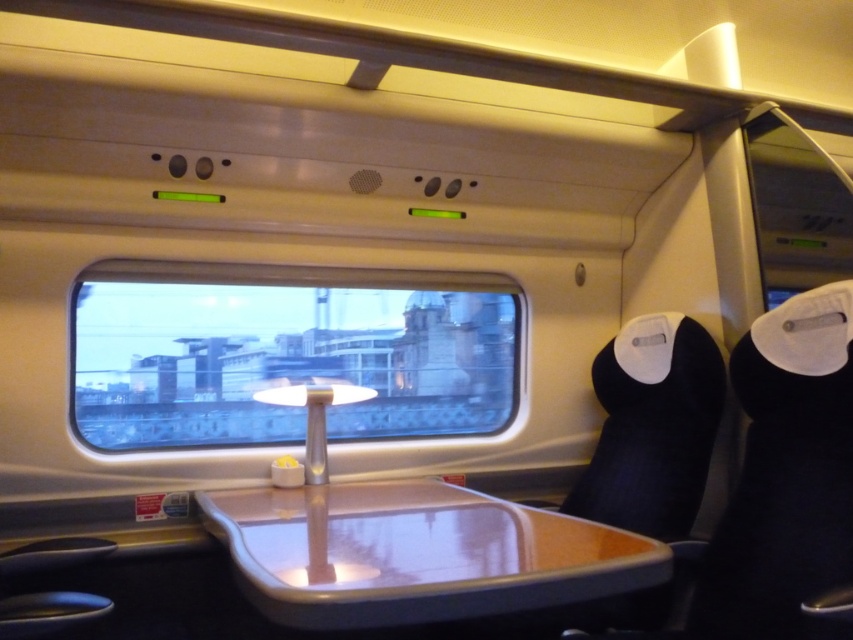
You are a passenger sitting in the train compartment and want to place your phone on the surface closest to the window. Which object should you choose between the transparent glass window at center and the matte plastic tray at center?

The matte plastic tray at center is the surface you can place your phone on, as the transparent glass window at center is a window and not a surface for placing items.

You are inside the train compartment and looking through the window. There are two points marked on the window at coordinates point (132, 339) and point (442, 500). Which point is closer to you?

Point (442, 500) is closer to you because it is less further to the camera than point (132, 339).